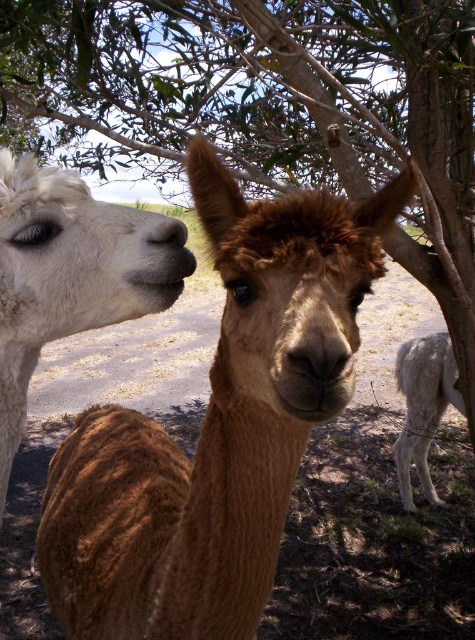
What are the coordinates of the brown fuzzy alpaca at center in the image?

The coordinates of the brown fuzzy alpaca at center are at point (x=217, y=426).

You are a photographer trying to capture both the white woolly alpaca at left and the matte black nose at center in a single frame. Which animal part is bigger in the image?

The white woolly alpaca at left is larger in size compared to the matte black nose at center, so the white woolly alpaca at left will appear bigger in the image.